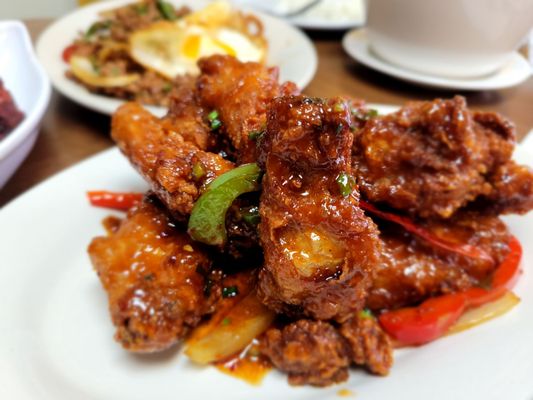
Where is `bowl`? Image resolution: width=533 pixels, height=400 pixels. bowl is located at coordinates (411, 15), (27, 71).